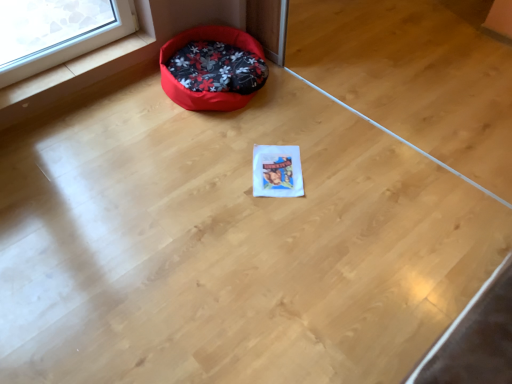
The image size is (512, 384). What do you see at coordinates (205, 91) in the screenshot?
I see `floral fabric dog bed at upper left` at bounding box center [205, 91].

Measure the distance between floral fabric dog bed at upper left and camera.

A distance of 6.57 feet exists between floral fabric dog bed at upper left and camera.

Find the location of a particular element. floral fabric dog bed at upper left is located at coordinates (205, 91).

Find the location of a particular element. floral fabric dog bed at upper left is located at coordinates (205, 91).